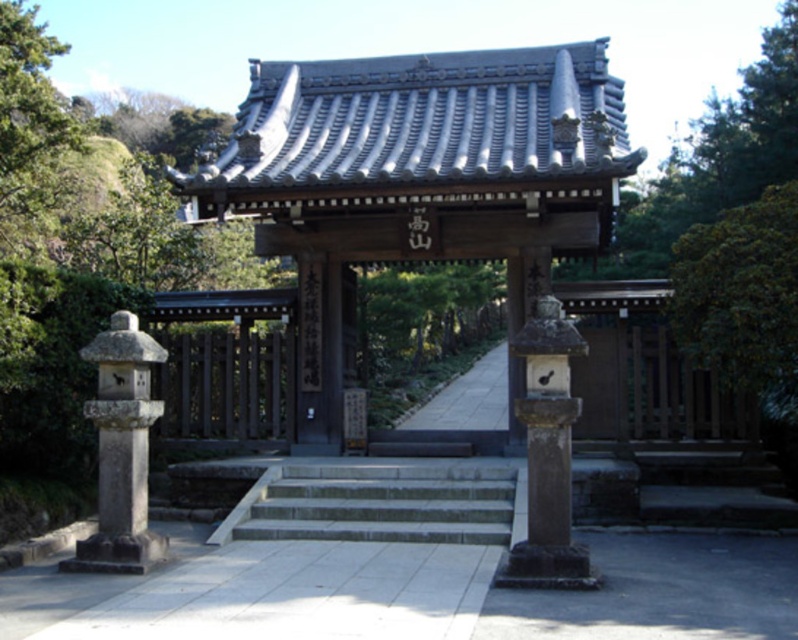
You are standing in front of the traditional Japanese gate. You notice a green leafy tree at right and a smooth stone lantern at center. Which object is positioned to the right of the other?

The green leafy tree at right is to the right of the smooth stone lantern at center.